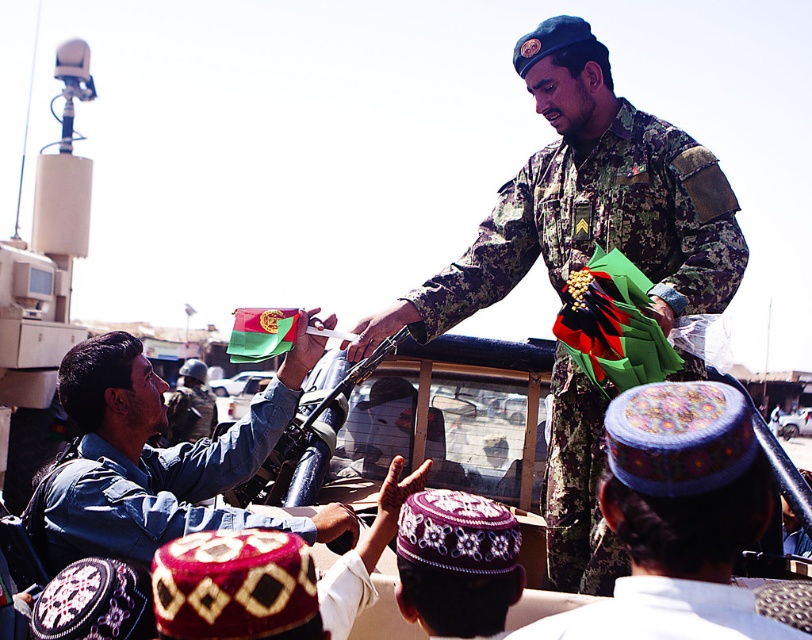
Can you confirm if camouflage fabric uniform at center is positioned below denim jacket at left?

No, camouflage fabric uniform at center is not below denim jacket at left.

Can you confirm if camouflage fabric uniform at center is positioned to the left of denim jacket at left?

No, camouflage fabric uniform at center is not to the left of denim jacket at left.

Where is `camouflage fabric uniform at center`? This screenshot has height=640, width=812. camouflage fabric uniform at center is located at coordinates (601, 221).

Does embroidered wool cap at center have a larger size compared to camouflage fabric uniform at upper center?

No, embroidered wool cap at center is not bigger than camouflage fabric uniform at upper center.

Is point (709, 548) farther from viewer compared to point (188, 420)?

No, (709, 548) is in front of (188, 420).

Does point (627, 465) lie in front of point (193, 396)?

Yes, it is.

Locate an element on the screen. Image resolution: width=812 pixels, height=640 pixels. embroidered wool cap at center is located at coordinates (677, 516).

Between point (106, 445) and point (784, 426), which one is positioned behind?

Positioned behind is point (784, 426).

Based on the photo, can you confirm if denim jacket at left is bigger than metallic silver vehicle at center?

Indeed, denim jacket at left has a larger size compared to metallic silver vehicle at center.

Which is in front, point (63, 550) or point (791, 416)?

Point (63, 550)

Where is `denim jacket at left`? denim jacket at left is located at coordinates (158, 490).